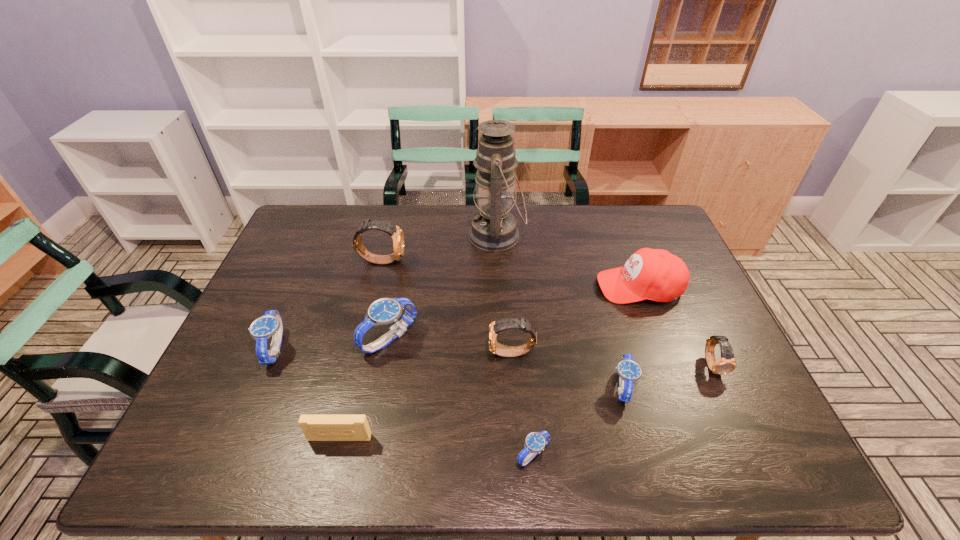
Locate an element on the screen. This screenshot has width=960, height=540. oil lamp is located at coordinates (493, 229).

This screenshot has width=960, height=540. I want to click on the tallest watch, so click(x=395, y=232).

The height and width of the screenshot is (540, 960). I want to click on the leftmost gold watch, so click(395, 232).

In order to click on baseball cap in this screenshot , I will do `click(649, 274)`.

Find the location of a particular element. The image size is (960, 540). the second gold watch from right to left is located at coordinates (500, 325).

The width and height of the screenshot is (960, 540). I want to click on the biggest blue watch, so click(384, 311).

Find the location of a particular element. The height and width of the screenshot is (540, 960). the leftmost blue watch is located at coordinates (269, 325).

Identify the location of the second biggest blue watch. (269, 325).

This screenshot has height=540, width=960. Find the location of `the smallest gold watch`. the smallest gold watch is located at coordinates (726, 364).

The width and height of the screenshot is (960, 540). I want to click on the rightmost watch, so click(726, 364).